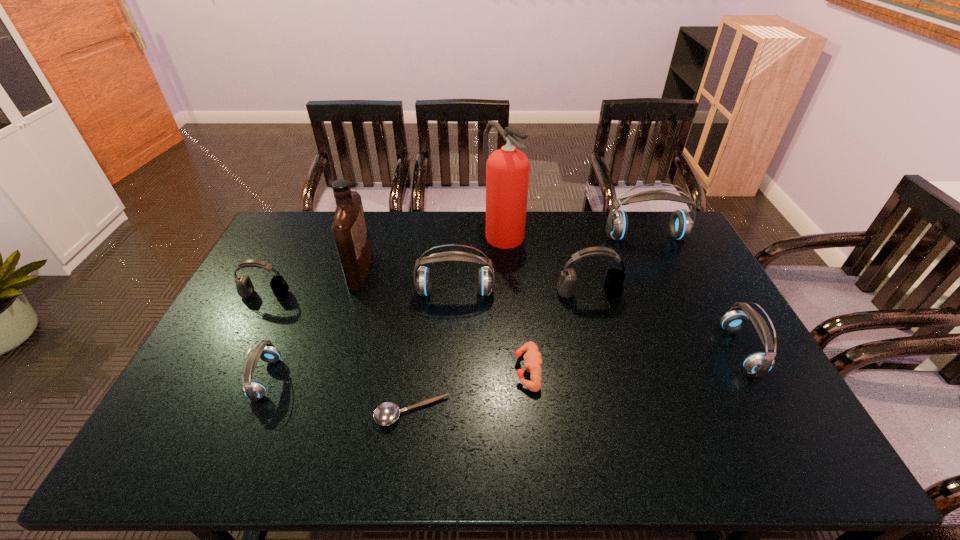
Identify the location of free space located 0.060m with the gloves of the red puncher facing forward. This screenshot has height=540, width=960. (492, 370).

Identify the location of blank area located 0.230m with the gloves of the red puncher facing forward. (430, 370).

The height and width of the screenshot is (540, 960). I want to click on vacant space located on the right of the ladle, so click(x=564, y=412).

Locate an element on the screen. The height and width of the screenshot is (540, 960). fire extinguisher that is positioned at the far edge is located at coordinates (507, 169).

At what (x,y) coordinates should I click in order to perform the action: click on headset at the far edge. Please return your answer as a coordinate pair (x, y). Looking at the image, I should click on (681, 223).

Find the location of `object that is at the left edge`. object that is at the left edge is located at coordinates (245, 288).

This screenshot has height=540, width=960. Identify the location of object that is at the far right corner. (681, 223).

In the image, there is a desktop. Where is `blank space at the far edge`? The width and height of the screenshot is (960, 540). blank space at the far edge is located at coordinates (460, 217).

The height and width of the screenshot is (540, 960). I want to click on vacant space at the left edge of the desktop, so click(218, 409).

The width and height of the screenshot is (960, 540). I want to click on vacant area at the right edge, so click(742, 340).